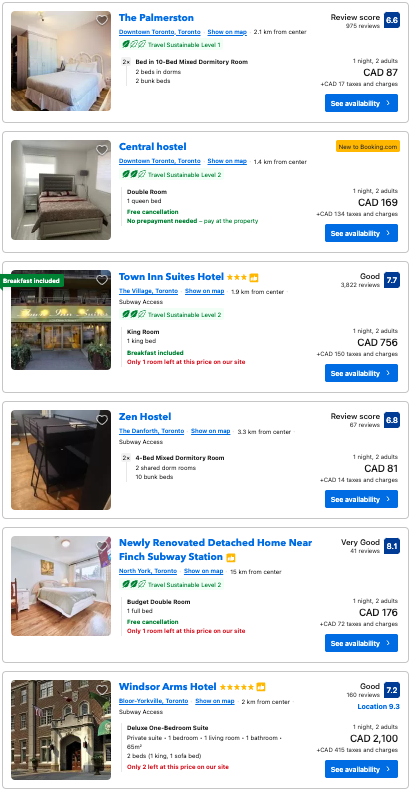
The height and width of the screenshot is (792, 413). I want to click on nightstand, so click(x=30, y=200), click(x=83, y=191), click(x=21, y=599), click(x=12, y=425).